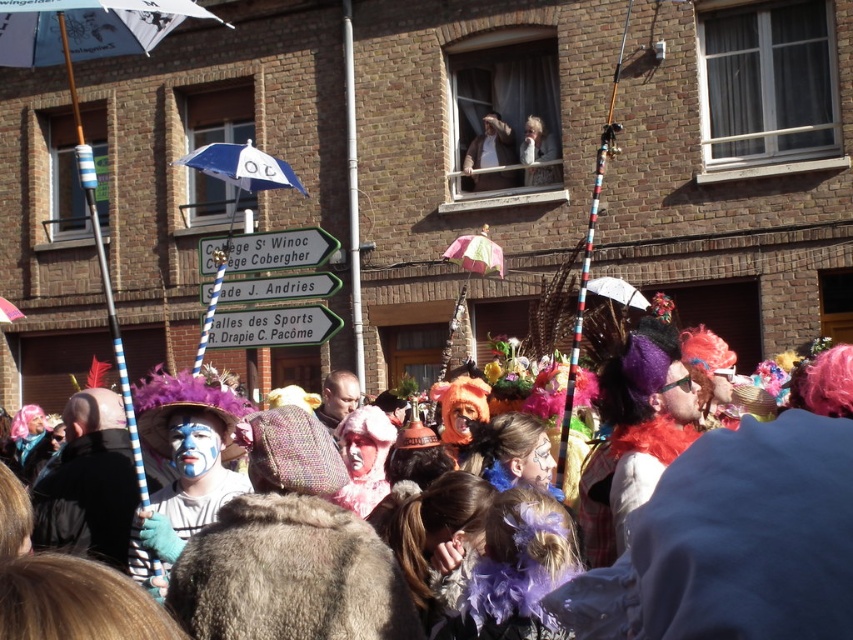
You are standing at the point marked as point (78, 33) in the image. If you want to move to the building in the background, which direction should you walk?

Since the point (78, 33) is in the foreground, you should walk towards the building in the background to reach it.

Consider the image. You are a photographer trying to capture the matte white face paint at upper center without any obstructions. Given that the white fabric umbrella at left is blocking your view, can you adjust your position to avoid it?

The white fabric umbrella at left is in front of the matte white face paint at upper center, so moving to the right or left side might allow you to position yourself where the umbrella no longer blocks the view of the matte white face paint at upper center.

You are a photographer standing in the crowd at the festival. You want to take a photo of the light brown leather jacket at upper center without the greensignboard at center blocking it. Is it possible to do so? Please explain.

The greensignboard at center is closer to the viewer than the light brown leather jacket at upper center. To avoid the greensignboard at center blocking the light brown leather jacket at upper center, you would need to position yourself or adjust your angle so that the greensignboard at center is not in front of the jacket. Since the greensignboard is closer, it may block the view unless you move around it or the jacket is elevated.